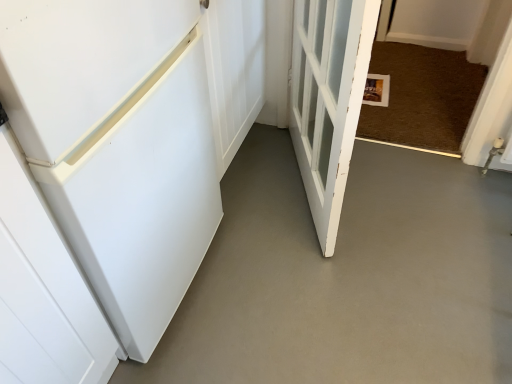
Locate an element on the screen. vacant area that is situated to the right of white wooden door at center, the second door from the left is located at coordinates (418, 200).